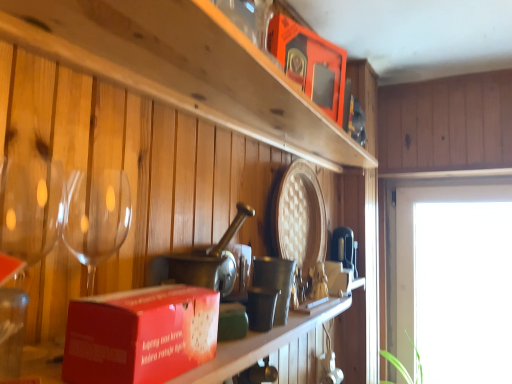
Locate an element on the screen. vacant space behind matte orange box at upper center, the 2th box ordered from the bottom is located at coordinates (307, 139).